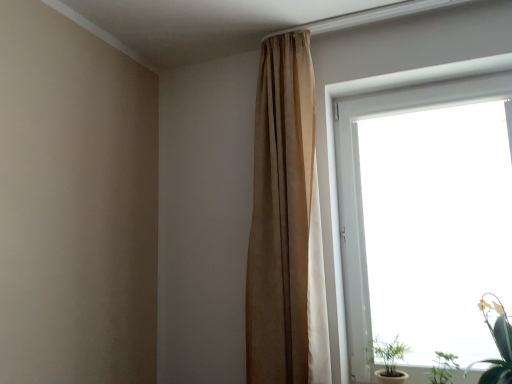
Question: Is point (380, 340) positioned closer to the camera than point (357, 190)?

Choices:
 (A) farther
 (B) closer

Answer: (B)

Question: Is green matte plant at lower right, arranged as the first houseplant when viewed from the left, in front of or behind transparent glass window at upper right in the image?

Choices:
 (A) front
 (B) behind

Answer: (B)

Question: Which object is positioned farthest from the beige fabric curtain at upper center?

Choices:
 (A) green leafy plant at lower right, the 2th houseplant when ordered from left to right
 (B) green matte plant at lower right, which is counted as the 3th houseplant, starting from the right
 (C) transparent glass window at upper right
 (D) green leafy plant at lower right, which ranks as the first houseplant in right-to-left order

Answer: (A)

Question: Estimate the real-world distances between objects in this image. Which object is farther from the beige fabric curtain at upper center?

Choices:
 (A) green matte plant at lower right, which is counted as the 3th houseplant, starting from the right
 (B) green leafy plant at lower right, which is the second houseplant from right to left
 (C) transparent glass window at upper right
 (D) green leafy plant at lower right, which ranks as the first houseplant in right-to-left order

Answer: (B)